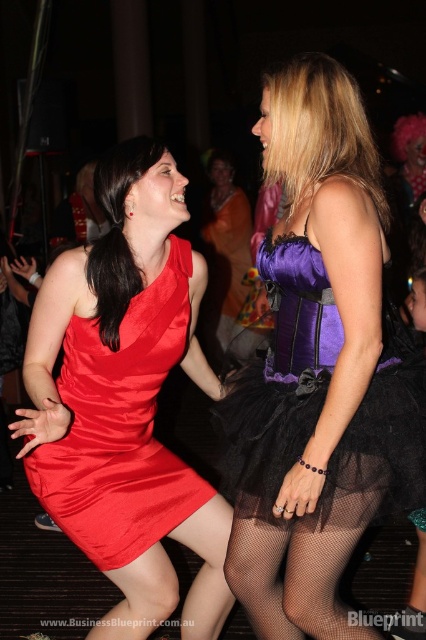
Question: Which point is farther to the camera?

Choices:
 (A) satin dress at left
 (B) black fishnet tights at lower center

Answer: (A)

Question: Which point is farther to the camera?

Choices:
 (A) (216, 348)
 (B) (344, 448)
 (C) (276, 592)
 (D) (75, 432)

Answer: (A)

Question: Can you confirm if satin dress at left is smaller than black fishnet tights at lower center?

Choices:
 (A) yes
 (B) no

Answer: (B)

Question: Which object is positioned closest to the satin dress at left?

Choices:
 (A) black fishnet tights at lower center
 (B) satin dress at center

Answer: (A)

Question: Does satin dress at left appear over black fishnet tights at lower center?

Choices:
 (A) yes
 (B) no

Answer: (A)

Question: Can you confirm if purple satin dress at center is positioned to the right of black fishnet tights at lower center?

Choices:
 (A) yes
 (B) no

Answer: (B)